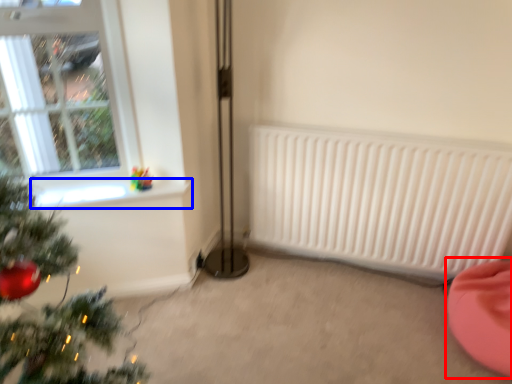
Question: Which object appears closest to the camera in this image, bean bag chair (highlighted by a red box) or window sill (highlighted by a blue box)?

Choices:
 (A) bean bag chair
 (B) window sill

Answer: (A)